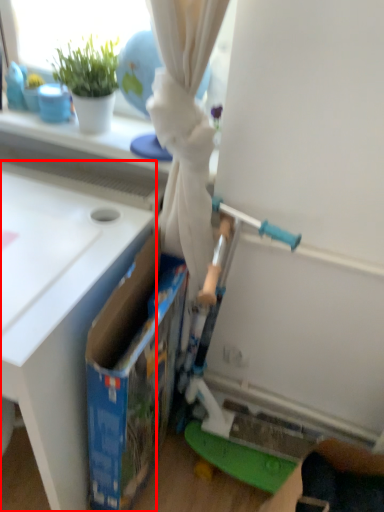
Question: Considering the relative positions of table (annotated by the red box) and storage box in the image provided, where is table (annotated by the red box) located with respect to the staircase?

Choices:
 (A) left
 (B) right

Answer: (A)